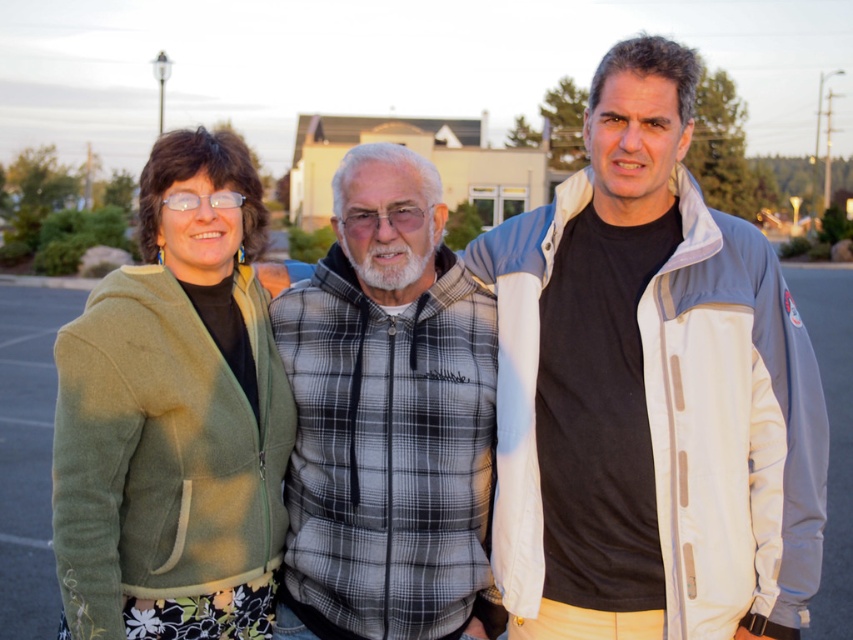
Question: Which object is closer to the camera taking this photo?

Choices:
 (A) green fleece jacket at left
 (B) plaid fabric vest at center

Answer: (A)

Question: Does white/light blue jacket at center have a smaller size compared to plaid fabric vest at center?

Choices:
 (A) no
 (B) yes

Answer: (A)

Question: Which object is closer to the camera taking this photo?

Choices:
 (A) plaid fabric vest at center
 (B) green fleece jacket at left
 (C) white/light blue jacket at center

Answer: (B)

Question: Is white/light blue jacket at center further to the viewer compared to green fleece jacket at left?

Choices:
 (A) yes
 (B) no

Answer: (A)

Question: Which point is farther to the camera?

Choices:
 (A) pyautogui.click(x=657, y=273)
 (B) pyautogui.click(x=389, y=371)

Answer: (B)

Question: Is white/light blue jacket at center below plaid fabric vest at center?

Choices:
 (A) yes
 (B) no

Answer: (B)